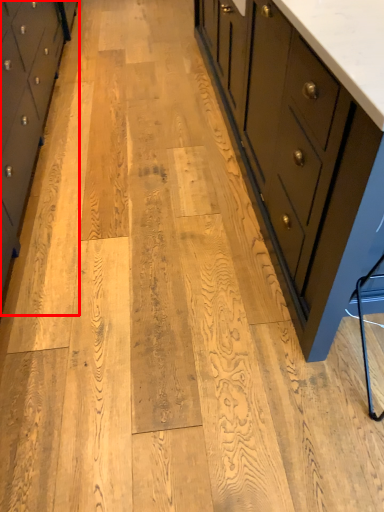
Question: From the image's perspective, considering the relative positions of chest of drawers (annotated by the red box) and chest of drawers in the image provided, where is chest of drawers (annotated by the red box) located with respect to the staircase?

Choices:
 (A) below
 (B) above

Answer: (A)